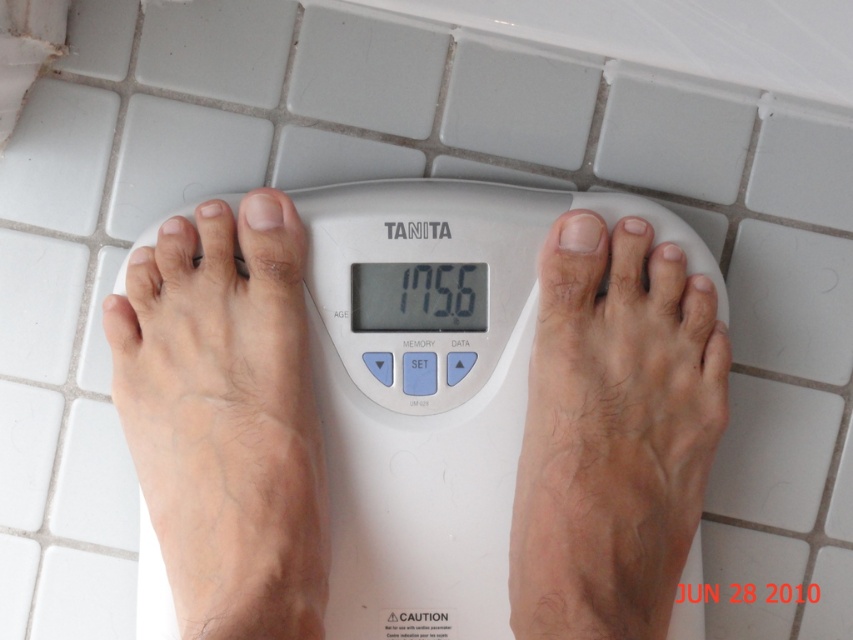
You are standing on the TANITA scale and want to check your weight. You notice two points marked on the scale. One is at point (427, 452) and the other at point (587, 472). Which point is closer to your feet when you stand normally?

Point (427, 452) is behind point (587, 472), so the point closer to your feet when standing normally would be point (587, 472) since it is in front.

You are a delivery person who needs to place a package on the floor. The package is 12 inches tall. If you stand at the point marked as point [639,196], will the package fit on the floor without exceeding the height limit?

The distance of point [639,196] from the camera is 28.60 inches. Since the package is 12 inches tall, it will not exceed the height limit as 12 inches is less than 28.60 inches. The package can be safely placed there.

You are designing a new bathroom layout and need to place the white plastic scale at center so that it accommodates both the light skin textured foot at center and another similar foot. Given that the scale is bigger than the foot, will the scale provide enough space for both feet?

The white plastic scale at center is bigger than the light skin textured foot at center, so yes, the scale should provide enough space to accommodate both feet since it is larger than a single foot.